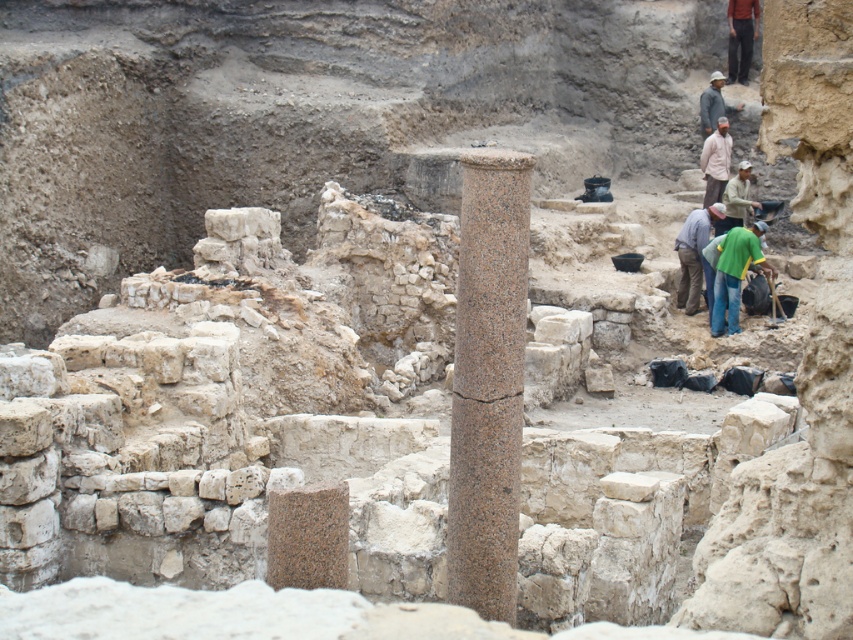
Question: Which object appears closest to the camera in this image?

Choices:
 (A) brown fabric pants at upper right
 (B) green fabric shirt at center right

Answer: (B)

Question: Estimate the real-world distances between objects in this image. Which object is closer to the granite column at center?

Choices:
 (A) green fabric shirt at center right
 (B) brown fabric hat at upper right

Answer: (A)

Question: Which point is closer to the camera taking this photo?

Choices:
 (A) (737, 289)
 (B) (474, 317)
 (C) (704, 129)

Answer: (B)

Question: Where is brown fabric pants at upper right located in relation to green fabric shirt at upper right in the image?

Choices:
 (A) right
 (B) left

Answer: (A)

Question: Is the position of brown fabric pants at upper right less distant than that of brown cotton shirt at center?

Choices:
 (A) no
 (B) yes

Answer: (A)

Question: Is brown fabric pants at upper right to the left of brown fabric hat at upper right from the viewer's perspective?

Choices:
 (A) yes
 (B) no

Answer: (B)